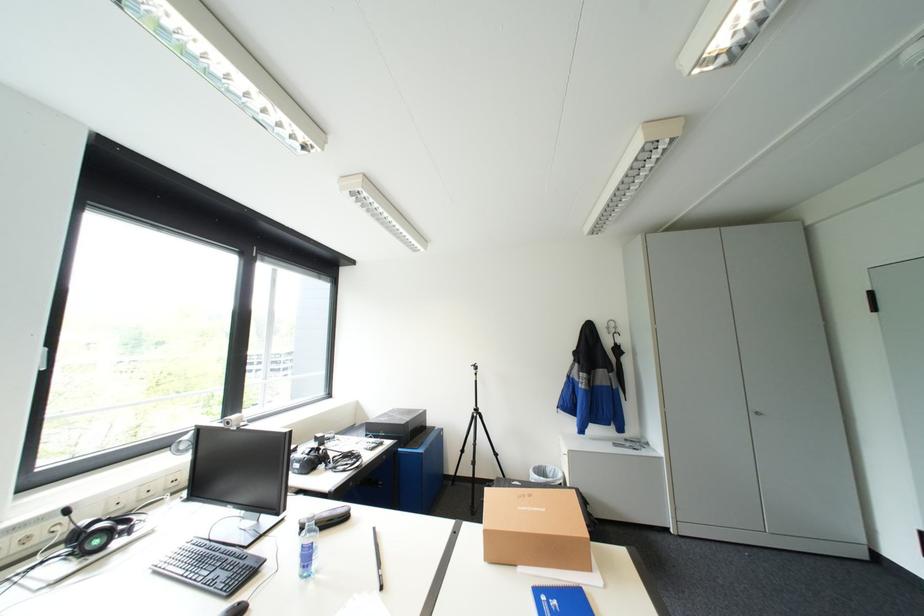
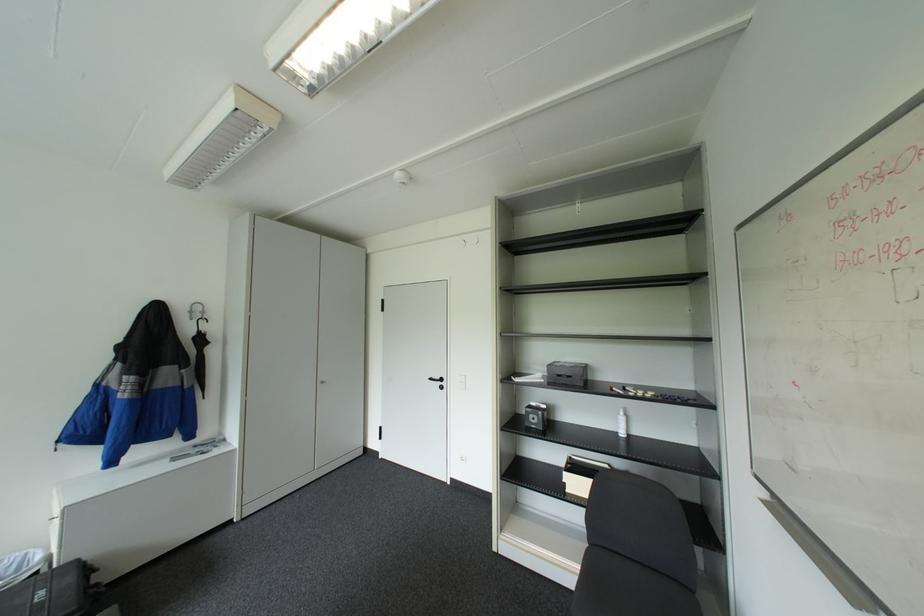
Question: How did the camera likely rotate?

Choices:
 (A) Left
 (B) Right
 (C) Up
 (D) Down

Answer: (B)